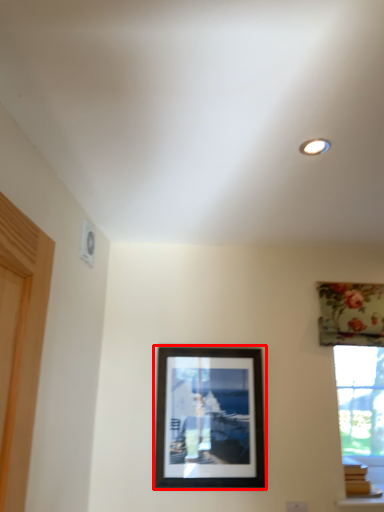
Question: From the image, what is the correct spatial relationship of picture frame (annotated by the red box) in relation to curtain?

Choices:
 (A) right
 (B) left

Answer: (B)